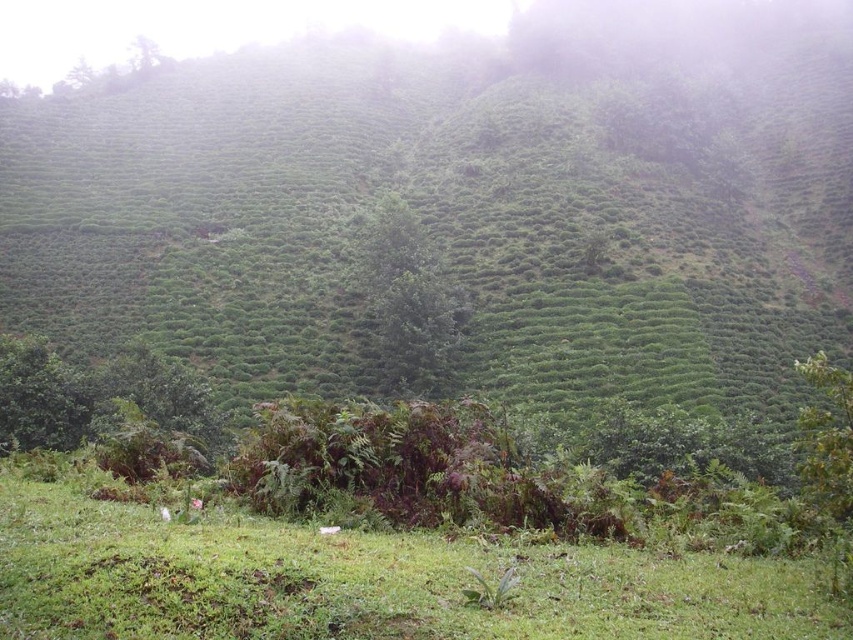
Question: Is green leafy hillside at center positioned in front of green grassy at lower center?

Choices:
 (A) no
 (B) yes

Answer: (A)

Question: Is green leafy hillside at center closer to the viewer compared to green grassy at lower center?

Choices:
 (A) no
 (B) yes

Answer: (A)

Question: Among these objects, which one is farthest from the camera?

Choices:
 (A) green grassy at lower center
 (B) green leafy hillside at center

Answer: (B)

Question: Does green leafy hillside at center appear under green grassy at lower center?

Choices:
 (A) no
 (B) yes

Answer: (A)

Question: Which of the following is the farthest from the observer?

Choices:
 (A) green leafy hillside at center
 (B) green grassy at lower center

Answer: (A)